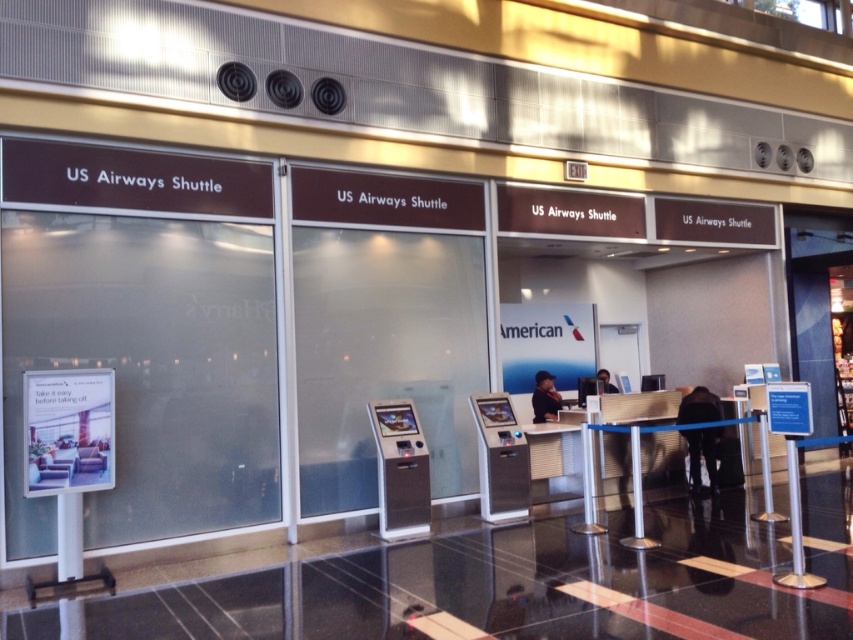
Question: Among these points, which one is farthest from the camera?

Choices:
 (A) (538, 392)
 (B) (697, 406)
 (C) (605, 392)

Answer: (C)

Question: Which point is closer to the camera?

Choices:
 (A) (546, 394)
 (B) (596, 376)

Answer: (A)

Question: Which point is farther to the camera?

Choices:
 (A) matte black laptop at center
 (B) dark fabric jacket at center

Answer: (A)

Question: Does dark fabric jacket at center have a lesser width compared to dark blue shirt at center?

Choices:
 (A) yes
 (B) no

Answer: (B)

Question: Is dark fabric jacket at center to the left of matte black laptop at center from the viewer's perspective?

Choices:
 (A) no
 (B) yes

Answer: (A)

Question: Does dark fabric jacket at center appear over dark blue shirt at center?

Choices:
 (A) no
 (B) yes

Answer: (A)